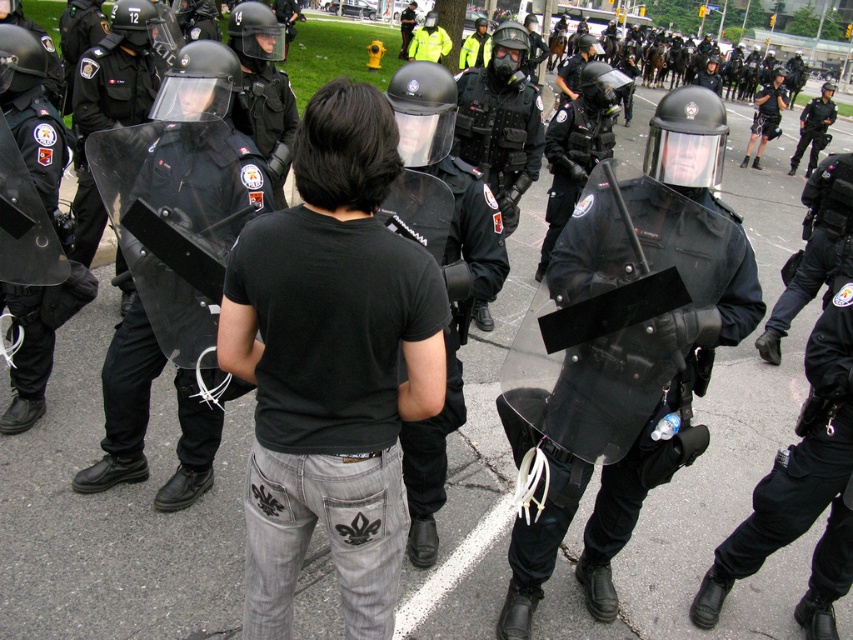
Question: Can you confirm if black matte t-shirt at center is wider than black matte shirt at center?

Choices:
 (A) yes
 (B) no

Answer: (B)

Question: Is clear plastic shield at center to the left of black matte shirt at center from the viewer's perspective?

Choices:
 (A) no
 (B) yes

Answer: (A)

Question: Which of the following is the closest to the observer?

Choices:
 (A) (184, 372)
 (B) (717, 148)

Answer: (B)

Question: Among these points, which one is nearest to the camera?

Choices:
 (A) (401, 67)
 (B) (136, 442)

Answer: (A)

Question: Can you confirm if black matte t-shirt at center is smaller than black matte shirt at center?

Choices:
 (A) yes
 (B) no

Answer: (A)

Question: Among these objects, which one is nearest to the camera?

Choices:
 (A) black matte shirt at center
 (B) clear plastic shield at center
 (C) black matte t-shirt at center

Answer: (C)